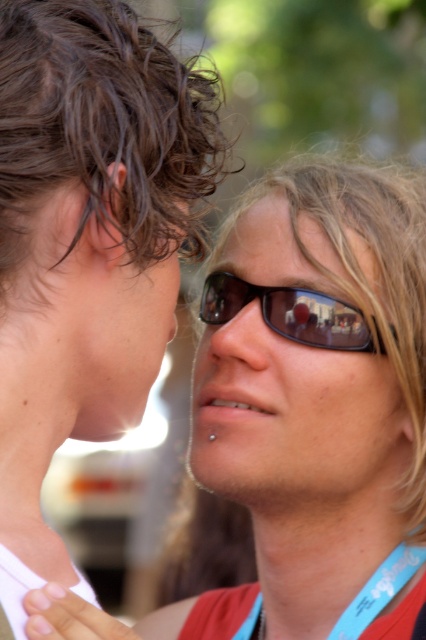
Question: Does matte skin at center come in front of smooth red lanyard at lower center?

Choices:
 (A) yes
 (B) no

Answer: (A)

Question: Is sunglasses at center to the left of matte black nose at center from the viewer's perspective?

Choices:
 (A) no
 (B) yes

Answer: (A)

Question: Is sunglasses at center thinner than smooth red lanyard at lower center?

Choices:
 (A) yes
 (B) no

Answer: (B)

Question: Among these points, which one is farthest from the camera?

Choices:
 (A) (359, 477)
 (B) (250, 460)
 (C) (255, 529)

Answer: (C)

Question: Which of the following is the closest to the observer?

Choices:
 (A) matte black sunglasses at center
 (B) matte black nose at center

Answer: (A)

Question: Which object is farther from the camera taking this photo?

Choices:
 (A) smooth red lanyard at lower center
 (B) matte white face at left
 (C) matte black sunglasses at center
 (D) matte black nose at center

Answer: (A)